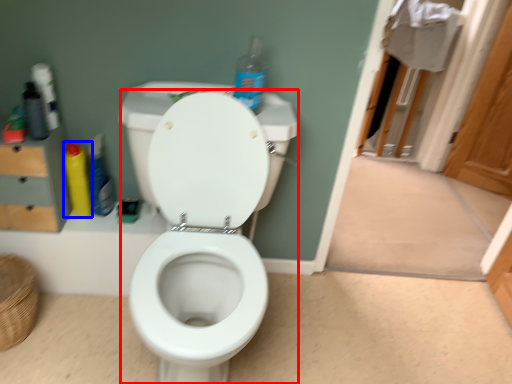
Question: Among these objects, which one is farthest to the camera, toilet (highlighted by a red box) or cleaning product (highlighted by a blue box)?

Choices:
 (A) toilet
 (B) cleaning product

Answer: (B)